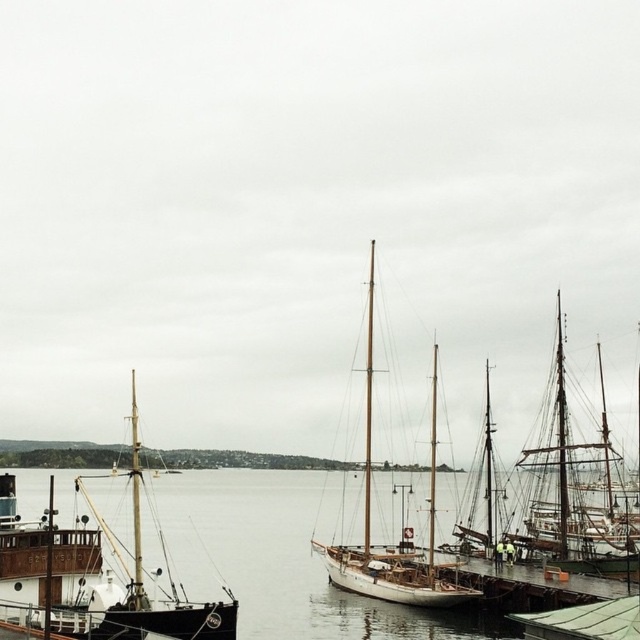
Is clear water at center to the left of dark brown wooden ship at left from the viewer's perspective?

Incorrect, clear water at center is not on the left side of dark brown wooden ship at left.

Is clear water at center positioned before dark brown wooden ship at left?

No, clear water at center is further to the viewer.

Between point (340, 600) and point (51, 518), which one is positioned in front?

Positioned in front is point (51, 518).

Where is `clear water at center`? The height and width of the screenshot is (640, 640). clear water at center is located at coordinates (278, 557).

How much distance is there between clear water at center and white wooden sailboat at center?

clear water at center and white wooden sailboat at center are 30.17 meters apart from each other.

Which is in front, point (237, 524) or point (433, 356)?

Point (433, 356)

What do you see at coordinates (278, 557) in the screenshot? I see `clear water at center` at bounding box center [278, 557].

Identify the location of clear water at center. (278, 557).

Does dark brown wooden ship at left come in front of white wooden sailboat at center?

Yes.

Can you confirm if dark brown wooden ship at left is thinner than white wooden sailboat at center?

In fact, dark brown wooden ship at left might be wider than white wooden sailboat at center.

Which is in front, point (179, 627) or point (451, 593)?

Point (179, 627) is more forward.

Identify the location of dark brown wooden ship at left. (88, 579).